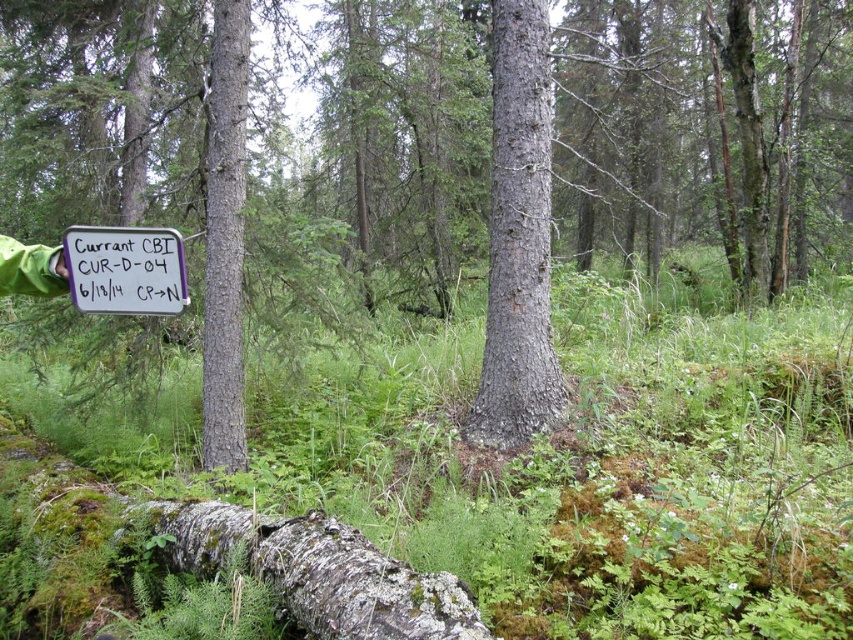
You are a hiker who wants to take a photo of the smooth bark tree at center and the white paper sign at center. Which object should you focus on first if you want to capture both in a single frame without moving your camera?

You should focus on the smooth bark tree at center first because it is taller than the white paper sign at center, so adjusting focus to the taller object ensures both are in the frame.

You are a hiker who wants to take a photo of the white paper sign at center. However, there is a smooth gray tree trunk at center in the way. Can you move the sign to the right to avoid the tree trunk?

The smooth gray tree trunk at center is located above the white paper sign at center, so moving the sign to the right might still leave it under the tree trunk depending on their horizontal positions. Check the horizontal alignment before moving.